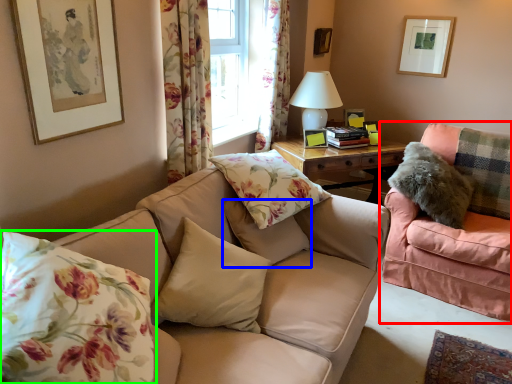
Question: Estimate the real-world distances between objects in this image. Which object is closer to studio couch (highlighted by a red box), pillow (highlighted by a blue box) or pillow (highlighted by a green box)?

Choices:
 (A) pillow
 (B) pillow

Answer: (A)